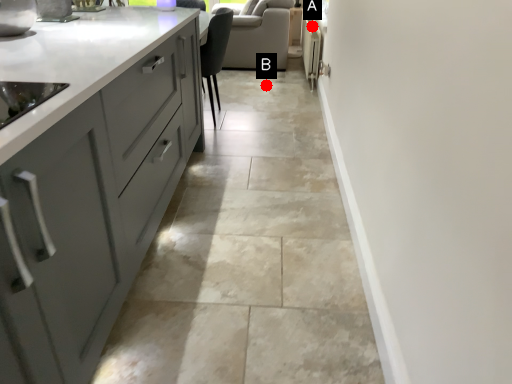
Question: Two points are circled on the image, labeled by A and B beside each circle. Among these points, which one is nearest to the camera?

Choices:
 (A) A is closer
 (B) B is closer

Answer: (A)